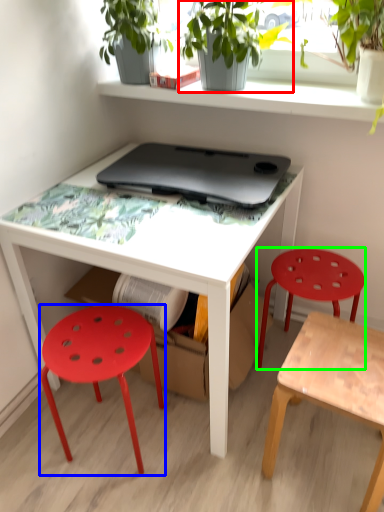
Question: Considering the real-world distances, which object is closest to houseplant (highlighted by a red box)? stool (highlighted by a blue box) or stool (highlighted by a green box).

Choices:
 (A) stool
 (B) stool

Answer: (B)